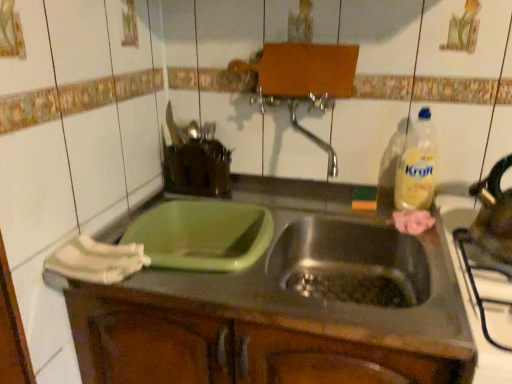
The width and height of the screenshot is (512, 384). Find the location of `shiny metallic tea pot at right`. shiny metallic tea pot at right is located at coordinates (493, 214).

What is the approximate height of shiny metallic tea pot at right?

shiny metallic tea pot at right is 22.42 centimeters in height.

Locate an element on the screen. The width and height of the screenshot is (512, 384). yellow plastic bottle at right is located at coordinates (417, 166).

You are a GUI agent. You are given a task and a screenshot of the screen. Output one action in this format:
    pyautogui.click(x=<x>, y=<y>)
    Task: Click on the green plastic container at center-left
    
    Given the screenshot: What is the action you would take?
    pyautogui.click(x=283, y=307)

At what (x,y) coordinates should I click in order to perform the action: click on shiny metallic tea pot at right. Please return your answer as a coordinate pair (x, y). The height and width of the screenshot is (384, 512). Looking at the image, I should click on (493, 214).

Between yellow plastic bottle at right and green plastic container at center-left, which one has less height?

green plastic container at center-left is shorter.

In the scene shown: Considering the relative positions of yellow plastic bottle at right and green plastic container at center-left in the image provided, is yellow plastic bottle at right to the right of green plastic container at center-left from the viewer's perspective?

Correct, you'll find yellow plastic bottle at right to the right of green plastic container at center-left.

Would you say yellow plastic bottle at right is outside green plastic container at center-left?

Absolutely, yellow plastic bottle at right is external to green plastic container at center-left.

You are a GUI agent. You are given a task and a screenshot of the screen. Output one action in this format:
    pyautogui.click(x=<x>, y=<y>)
    Task: Click on the bottle located behind the green plastic container at center-left
    This screenshot has width=512, height=384.
    Given the screenshot: What is the action you would take?
    417,166

From the image's perspective, between shiny metallic tea pot at right and stainless steel kettle at right, which one is located above?

shiny metallic tea pot at right, from the image's perspective.

Considering the relative sizes of shiny metallic tea pot at right and stainless steel kettle at right in the image provided, is shiny metallic tea pot at right taller than stainless steel kettle at right?

Yes.

From a real-world perspective, is shiny metallic tea pot at right physically above stainless steel kettle at right?

Indeed, from a real-world perspective, shiny metallic tea pot at right stands above stainless steel kettle at right.

Identify the location of tea pot to the right of stainless steel kettle at right. (493, 214).

Is stainless steel kettle at right taller or shorter than green plastic container at center-left?

Clearly, stainless steel kettle at right is shorter compared to green plastic container at center-left.

Could you tell me if stainless steel kettle at right is facing green plastic container at center-left?

No, stainless steel kettle at right is not oriented towards green plastic container at center-left.

Which object is closer to the camera, stainless steel kettle at right or green plastic container at center-left?

stainless steel kettle at right is more forward.

Is yellow plastic bottle at right beside stainless steel kettle at right?

No, yellow plastic bottle at right is not next to stainless steel kettle at right.

Which object is positioned more to the right, yellow plastic bottle at right or stainless steel kettle at right?

From the viewer's perspective, stainless steel kettle at right appears more on the right side.

In terms of size, does yellow plastic bottle at right appear bigger or smaller than stainless steel kettle at right?

In the image, yellow plastic bottle at right appears to be smaller than stainless steel kettle at right.

Based on the photo, from a real-world perspective, is yellow plastic bottle at right under stainless steel kettle at right?

No, from a real-world perspective, yellow plastic bottle at right is not beneath stainless steel kettle at right.

Is stainless steel kettle at right shorter than yellow plastic bottle at right?

Indeed, stainless steel kettle at right has a lesser height compared to yellow plastic bottle at right.

Is the depth of stainless steel kettle at right greater than that of yellow plastic bottle at right?

No, the depth of stainless steel kettle at right is less than that of yellow plastic bottle at right.

Which object is positioned more to the right, stainless steel kettle at right or yellow plastic bottle at right?

Positioned to the right is stainless steel kettle at right.

Between stainless steel kettle at right and yellow plastic bottle at right, which one has larger width?

With larger width is stainless steel kettle at right.

How much distance is there between yellow plastic bottle at right and shiny metallic tea pot at right?

The distance of yellow plastic bottle at right from shiny metallic tea pot at right is 19.77 centimeters.

From the image's perspective, which one is positioned higher, yellow plastic bottle at right or shiny metallic tea pot at right?

yellow plastic bottle at right.

Is yellow plastic bottle at right taller or shorter than shiny metallic tea pot at right?

Considering their sizes, yellow plastic bottle at right has more height than shiny metallic tea pot at right.

At what (x,y) coordinates should I click in order to perform the action: click on tea pot that is under the yellow plastic bottle at right (from a real-world perspective). Please return your answer as a coordinate pair (x, y). Looking at the image, I should click on (493, 214).

Based on the photo, is shiny metallic tea pot at right aimed at yellow plastic bottle at right?

No, shiny metallic tea pot at right is not turned towards yellow plastic bottle at right.

Looking at this image, between shiny metallic tea pot at right and yellow plastic bottle at right, which one appears on the right side from the viewer's perspective?

Positioned to the right is shiny metallic tea pot at right.

Is shiny metallic tea pot at right in front of or behind yellow plastic bottle at right in the image?

In the image, shiny metallic tea pot at right appears in front of yellow plastic bottle at right.

At what (x,y) coordinates should I click in order to perform the action: click on bottle located behind the green plastic container at center-left. Please return your answer as a coordinate pair (x, y). The image size is (512, 384). Looking at the image, I should click on (417, 166).

The image size is (512, 384). In order to click on tea pot that is above the stainless steel kettle at right (from the image's perspective) in this screenshot , I will do `click(493, 214)`.

From the image, which object appears to be farther from green plastic container at center-left, yellow plastic bottle at right or shiny metallic tea pot at right?

shiny metallic tea pot at right.

Looking at the image, which one is located closer to green plastic container at center-left, shiny metallic tea pot at right or stainless steel kettle at right?

Based on the image, stainless steel kettle at right appears to be nearer to green plastic container at center-left.

Considering their positions, is stainless steel kettle at right positioned closer to green plastic container at center-left than shiny metallic tea pot at right?

The object closer to green plastic container at center-left is stainless steel kettle at right.

Consider the image. Based on their spatial positions, is stainless steel kettle at right or shiny metallic tea pot at right further from yellow plastic bottle at right?

stainless steel kettle at right.

Considering their positions, is shiny metallic tea pot at right positioned further to stainless steel kettle at right than green plastic container at center-left?

Based on the image, green plastic container at center-left appears to be further to stainless steel kettle at right.

Considering their positions, is green plastic container at center-left positioned closer to stainless steel kettle at right than yellow plastic bottle at right?

The object closer to stainless steel kettle at right is yellow plastic bottle at right.

Considering their positions, is stainless steel kettle at right positioned closer to green plastic container at center-left than yellow plastic bottle at right?

Among the two, stainless steel kettle at right is located nearer to green plastic container at center-left.

Estimate the real-world distances between objects in this image. Which object is closer to yellow plastic bottle at right, shiny metallic tea pot at right or green plastic container at center-left?

shiny metallic tea pot at right lies closer to yellow plastic bottle at right than the other object.

The image size is (512, 384). Identify the location of bottle located between green plastic container at center-left and stainless steel kettle at right in the left-right direction. (417, 166).

Locate an element on the screen. appliance between green plastic container at center-left and shiny metallic tea pot at right is located at coordinates (469, 298).

Locate an element on the screen. The height and width of the screenshot is (384, 512). bottle between green plastic container at center-left and shiny metallic tea pot at right in the horizontal direction is located at coordinates (417, 166).

Image resolution: width=512 pixels, height=384 pixels. Find the location of `tea pot between stainless steel kettle at right and yellow plastic bottle at right in the front-back direction`. tea pot between stainless steel kettle at right and yellow plastic bottle at right in the front-back direction is located at coordinates (493, 214).